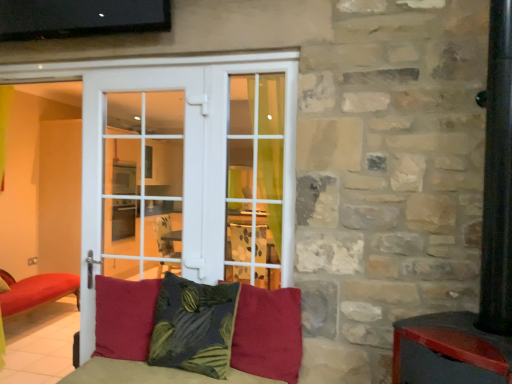
What do you see at coordinates (188, 172) in the screenshot? I see `white glass door at center` at bounding box center [188, 172].

What do you see at coordinates (268, 333) in the screenshot? I see `velvet red pillow at center, the 3th pillow in the left-to-right sequence` at bounding box center [268, 333].

Locate an element on the screen. This screenshot has width=512, height=384. white glass door at center is located at coordinates (188, 172).

Is velvet red pillow at center, the 3th pillow in the left-to-right sequence, turned away from white glass door at center?

No.

There is a velvet red pillow at center, the 1th pillow when ordered from right to left. Find the location of `door above it (from a real-world perspective)`. door above it (from a real-world perspective) is located at coordinates (188, 172).

Which is further, (288, 294) or (295, 87)?

Positioned behind is point (295, 87).

Which of these two, velvet red pillow at center, the 1th pillow when ordered from right to left, or white glass door at center, is wider?

With larger width is white glass door at center.

Are velvet red cushion at center, which is counted as the 1th pillow, starting from the left, and velvet red pillow at center, the 3th pillow in the left-to-right sequence, located far from each other?

No, velvet red cushion at center, which is counted as the 1th pillow, starting from the left, is not far from velvet red pillow at center, the 3th pillow in the left-to-right sequence.

Looking at their sizes, would you say velvet red cushion at center, which is counted as the 1th pillow, starting from the left, is wider or thinner than velvet red pillow at center, the 1th pillow when ordered from right to left?

In the image, velvet red cushion at center, which is counted as the 1th pillow, starting from the left, appears to be wider than velvet red pillow at center, the 1th pillow when ordered from right to left.

Is velvet red cushion at center, acting as the 3th pillow starting from the right, oriented away from velvet red pillow at center, the 1th pillow when ordered from right to left?

No, velvet red pillow at center, the 1th pillow when ordered from right to left, is not at the back of velvet red cushion at center, acting as the 3th pillow starting from the right.

Considering the sizes of velvet red cushion at center, which is counted as the 1th pillow, starting from the left, and velvet red pillow at center, the 1th pillow when ordered from right to left, in the image, is velvet red cushion at center, which is counted as the 1th pillow, starting from the left, taller or shorter than velvet red pillow at center, the 1th pillow when ordered from right to left,?

In the image, velvet red cushion at center, which is counted as the 1th pillow, starting from the left, appears to be taller than velvet red pillow at center, the 1th pillow when ordered from right to left.

Consider the image. What's the angular difference between velvet red pillow at center, the 3th pillow in the left-to-right sequence, and velvet red cushion at center, which is counted as the 1th pillow, starting from the left,'s facing directions?

velvet red pillow at center, the 3th pillow in the left-to-right sequence, and velvet red cushion at center, which is counted as the 1th pillow, starting from the left, are facing 4.67 degrees away from each other.

In the scene shown: Which object is positioned more to the right, velvet red pillow at center, the 1th pillow when ordered from right to left, or velvet red cushion at center, which is counted as the 1th pillow, starting from the left?

Positioned to the right is velvet red pillow at center, the 1th pillow when ordered from right to left.

Is velvet red pillow at center, the 3th pillow in the left-to-right sequence, in front of velvet red cushion at center, acting as the 3th pillow starting from the right?

Yes, it is.

From a real-world perspective, is velvet red pillow at center, the 1th pillow when ordered from right to left, positioned over velvet red cushion at center, which is counted as the 1th pillow, starting from the left, based on gravity?

Yes.

Between dark green textured pillow at center, the 2th pillow from the right, and white glass door at center, which one has larger size?

white glass door at center is bigger.

Is dark green textured pillow at center, the 2th pillow from the right, aimed at white glass door at center?

No, dark green textured pillow at center, the 2th pillow from the right, does not turn towards white glass door at center.

You are a GUI agent. You are given a task and a screenshot of the screen. Output one action in this format:
    pyautogui.click(x=<x>, y=<y>)
    Task: Click on the 1st pillow in front of the white glass door at center
    The image size is (512, 384).
    Given the screenshot: What is the action you would take?
    pyautogui.click(x=124, y=317)

Is white glass door at center further to the viewer compared to velvet red cushion at center, which is counted as the 1th pillow, starting from the left?

Yes, white glass door at center is behind velvet red cushion at center, which is counted as the 1th pillow, starting from the left.

Which is correct: white glass door at center is inside velvet red cushion at center, which is counted as the 1th pillow, starting from the left, or outside of it?

white glass door at center is not inside velvet red cushion at center, which is counted as the 1th pillow, starting from the left, it's outside.

How many degrees apart are the facing directions of white glass door at center and velvet red cushion at center, which is counted as the 1th pillow, starting from the left?

There is a 0.185-degree angle between the facing directions of white glass door at center and velvet red cushion at center, which is counted as the 1th pillow, starting from the left.

Is dark green textured pillow at center, which is the second pillow in left-to-right order, taller or shorter than velvet red pillow at center, the 1th pillow when ordered from right to left?

Clearly, dark green textured pillow at center, which is the second pillow in left-to-right order, is taller compared to velvet red pillow at center, the 1th pillow when ordered from right to left.

Is dark green textured pillow at center, which is the second pillow in left-to-right order, oriented towards velvet red pillow at center, the 3th pillow in the left-to-right sequence?

No, dark green textured pillow at center, which is the second pillow in left-to-right order, is not oriented towards velvet red pillow at center, the 3th pillow in the left-to-right sequence.

From a real-world perspective, between dark green textured pillow at center, which is the second pillow in left-to-right order, and velvet red pillow at center, the 1th pillow when ordered from right to left, who is vertically lower?

velvet red pillow at center, the 1th pillow when ordered from right to left.

Does dark green textured pillow at center, which is the second pillow in left-to-right order, have a larger size compared to velvet red pillow at center, the 3th pillow in the left-to-right sequence?

Indeed, dark green textured pillow at center, which is the second pillow in left-to-right order, has a larger size compared to velvet red pillow at center, the 3th pillow in the left-to-right sequence.

Between velvet red pillow at center, the 1th pillow when ordered from right to left, and dark green textured pillow at center, which is the second pillow in left-to-right order, which one has smaller size?

velvet red pillow at center, the 1th pillow when ordered from right to left.

Which object is thinner, velvet red pillow at center, the 3th pillow in the left-to-right sequence, or dark green textured pillow at center, the 2th pillow from the right?

With smaller width is velvet red pillow at center, the 3th pillow in the left-to-right sequence.

From the velvet red pillow at center, the 1th pillow when ordered from right to left, count the 1st pillow to the left and point to it. Please provide its 2D coordinates.

[(194, 326)]

From the image's perspective, is velvet red pillow at center, the 3th pillow in the left-to-right sequence, above dark green textured pillow at center, which is the second pillow in left-to-right order?

→ No, from the image's perspective, velvet red pillow at center, the 3th pillow in the left-to-right sequence, is not on top of dark green textured pillow at center, which is the second pillow in left-to-right order.

You are a GUI agent. You are given a task and a screenshot of the screen. Output one action in this format:
    pyautogui.click(x=<x>, y=<y>)
    Task: Click on the door that is behind the velvet red pillow at center, the 1th pillow when ordered from right to left
    The height and width of the screenshot is (384, 512).
    Given the screenshot: What is the action you would take?
    pyautogui.click(x=188, y=172)

You are a GUI agent. You are given a task and a screenshot of the screen. Output one action in this format:
    pyautogui.click(x=<x>, y=<y>)
    Task: Click on the 1st pillow above the velvet red cushion at center, acting as the 3th pillow starting from the right (from the image's perspective)
    The width and height of the screenshot is (512, 384).
    Given the screenshot: What is the action you would take?
    pyautogui.click(x=268, y=333)

When comparing their distances from dark green textured pillow at center, which is the second pillow in left-to-right order, does velvet red cushion at center, which is counted as the 1th pillow, starting from the left, or white glass door at center seem further?

white glass door at center is positioned further to the anchor dark green textured pillow at center, which is the second pillow in left-to-right order.

From the image, which object appears to be nearer to white glass door at center, velvet red cushion at center, acting as the 3th pillow starting from the right, or dark green textured pillow at center, which is the second pillow in left-to-right order?

dark green textured pillow at center, which is the second pillow in left-to-right order, is positioned closer to the anchor white glass door at center.

Considering their positions, is white glass door at center positioned closer to dark green textured pillow at center, which is the second pillow in left-to-right order, than velvet red pillow at center, the 3th pillow in the left-to-right sequence?

velvet red pillow at center, the 3th pillow in the left-to-right sequence.

Which object lies nearer to the anchor point velvet red pillow at center, the 3th pillow in the left-to-right sequence, dark green textured pillow at center, the 2th pillow from the right, or white glass door at center?

The object closer to velvet red pillow at center, the 3th pillow in the left-to-right sequence, is dark green textured pillow at center, the 2th pillow from the right.

From the image, which object appears to be farther from white glass door at center, dark green textured pillow at center, the 2th pillow from the right, or velvet red pillow at center, the 3th pillow in the left-to-right sequence?

velvet red pillow at center, the 3th pillow in the left-to-right sequence, lies further to white glass door at center than the other object.

When comparing their distances from velvet red cushion at center, which is counted as the 1th pillow, starting from the left, does white glass door at center or dark green textured pillow at center, which is the second pillow in left-to-right order, seem further?

white glass door at center lies further to velvet red cushion at center, which is counted as the 1th pillow, starting from the left, than the other object.

Considering their positions, is dark green textured pillow at center, the 2th pillow from the right, positioned further to velvet red pillow at center, the 1th pillow when ordered from right to left, than velvet red cushion at center, acting as the 3th pillow starting from the right?

velvet red cushion at center, acting as the 3th pillow starting from the right, is further to velvet red pillow at center, the 1th pillow when ordered from right to left.

Considering their positions, is velvet red pillow at center, the 3th pillow in the left-to-right sequence, positioned closer to velvet red cushion at center, acting as the 3th pillow starting from the right, than dark green textured pillow at center, the 2th pillow from the right?

dark green textured pillow at center, the 2th pillow from the right.

This screenshot has width=512, height=384. Identify the location of door between velvet red cushion at center, acting as the 3th pillow starting from the right, and velvet red pillow at center, the 1th pillow when ordered from right to left, in the horizontal direction. (188, 172).

At what (x,y) coordinates should I click in order to perform the action: click on pillow between velvet red cushion at center, acting as the 3th pillow starting from the right, and velvet red pillow at center, the 3th pillow in the left-to-right sequence. Please return your answer as a coordinate pair (x, y). Looking at the image, I should click on (194, 326).

At what (x,y) coordinates should I click in order to perform the action: click on pillow between white glass door at center and velvet red pillow at center, the 3th pillow in the left-to-right sequence, in the horizontal direction. Please return your answer as a coordinate pair (x, y). The height and width of the screenshot is (384, 512). Looking at the image, I should click on [x=194, y=326].